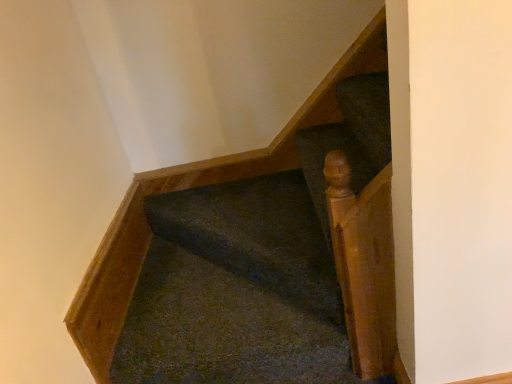
Question: Considering the positions of light brown polished wood handrail at upper right and dark green carpet at center in the image, is light brown polished wood handrail at upper right bigger or smaller than dark green carpet at center?

Choices:
 (A) big
 (B) small

Answer: (B)

Question: From their relative heights in the image, would you say light brown polished wood handrail at upper right is taller or shorter than dark green carpet at center?

Choices:
 (A) tall
 (B) short

Answer: (A)

Question: Is light brown polished wood handrail at upper right spatially inside dark green carpet at center, or outside of it?

Choices:
 (A) inside
 (B) outside

Answer: (B)

Question: Is dark green carpet at center in front of or behind light brown polished wood handrail at upper right in the image?

Choices:
 (A) behind
 (B) front

Answer: (A)

Question: From the image's perspective, is dark green carpet at center above or below light brown polished wood handrail at upper right?

Choices:
 (A) above
 (B) below

Answer: (A)

Question: Is dark green carpet at center to the left or to the right of light brown polished wood handrail at upper right in the image?

Choices:
 (A) right
 (B) left

Answer: (B)

Question: In terms of width, does dark green carpet at center look wider or thinner when compared to light brown polished wood handrail at upper right?

Choices:
 (A) wide
 (B) thin

Answer: (A)